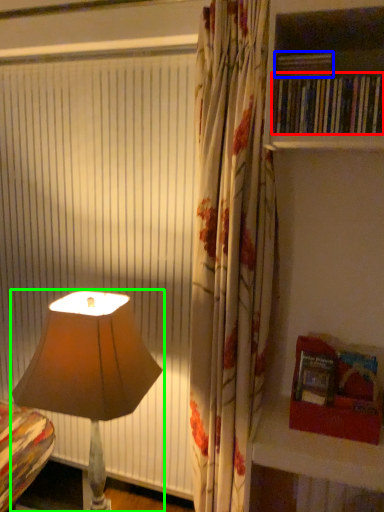
Question: Based on their relative distances, which object is nearer to book (highlighted by a red box)? Choose from book (highlighted by a blue box) and lamp (highlighted by a green box).

Choices:
 (A) book
 (B) lamp

Answer: (A)